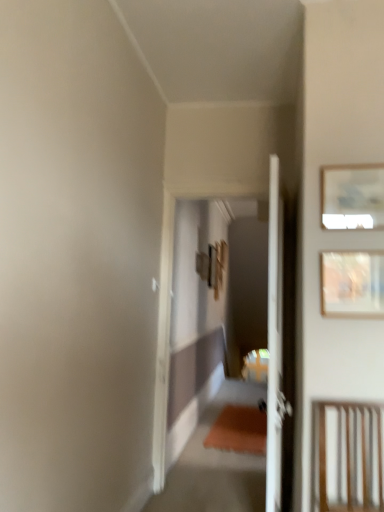
What do you see at coordinates (352, 197) in the screenshot?
I see `matte white picture frame at upper right, the second picture frame when ordered from bottom to top` at bounding box center [352, 197].

Find the location of a particular element. This screenshot has width=384, height=512. wooden slats at lower right is located at coordinates (348, 456).

Is wooden framed artwork at upper right, the 1th picture frame positioned from the bottom, shorter than matte white picture frame at upper right, the second picture frame when ordered from bottom to top?

In fact, wooden framed artwork at upper right, the 1th picture frame positioned from the bottom, may be taller than matte white picture frame at upper right, the second picture frame when ordered from bottom to top.

Can you confirm if wooden framed artwork at upper right, which ranks as the second picture frame in top-to-bottom order, is thinner than matte white picture frame at upper right, the second picture frame when ordered from bottom to top?

No.

Which of these two, wooden framed artwork at upper right, the 1th picture frame positioned from the bottom, or matte white picture frame at upper right, which is the first picture frame in top-to-bottom order, is bigger?

With larger size is wooden framed artwork at upper right, the 1th picture frame positioned from the bottom.

Is wooden framed artwork at upper right, the 1th picture frame positioned from the bottom, at the right side of matte white picture frame at upper right, which is the first picture frame in top-to-bottom order?

No.

The width and height of the screenshot is (384, 512). There is a wooden slats at lower right. In order to click on the 1st picture frame above it (from the image's perspective) in this screenshot , I will do `click(352, 284)`.

Who is taller, wooden slats at lower right or wooden framed artwork at upper right, the 1th picture frame positioned from the bottom?

With more height is wooden slats at lower right.

Considering the sizes of objects wooden slats at lower right and wooden framed artwork at upper right, which ranks as the second picture frame in top-to-bottom order, in the image provided, who is smaller, wooden slats at lower right or wooden framed artwork at upper right, which ranks as the second picture frame in top-to-bottom order,?

wooden framed artwork at upper right, which ranks as the second picture frame in top-to-bottom order.

Consider the image. Is wooden slats at lower right looking in the opposite direction of wooden framed artwork at upper right, which ranks as the second picture frame in top-to-bottom order?

That's not correct — wooden slats at lower right is not looking away from wooden framed artwork at upper right, which ranks as the second picture frame in top-to-bottom order.

Measure the distance from wooden framed artwork at upper right, which ranks as the second picture frame in top-to-bottom order, to wooden slats at lower right.

They are 52.89 centimeters apart.

Where is `furniture that is under the wooden framed artwork at upper right, which ranks as the second picture frame in top-to-bottom order (from a real-world perspective)`? Image resolution: width=384 pixels, height=512 pixels. furniture that is under the wooden framed artwork at upper right, which ranks as the second picture frame in top-to-bottom order (from a real-world perspective) is located at coordinates (348, 456).

Is there a large distance between wooden framed artwork at upper right, the 1th picture frame positioned from the bottom, and wooden slats at lower right?

No, there isn't a large distance between wooden framed artwork at upper right, the 1th picture frame positioned from the bottom, and wooden slats at lower right.

Can you confirm if wooden framed artwork at upper right, which ranks as the second picture frame in top-to-bottom order, is shorter than wooden slats at lower right?

Indeed, wooden framed artwork at upper right, which ranks as the second picture frame in top-to-bottom order, has a lesser height compared to wooden slats at lower right.

What's the angular difference between wooden slats at lower right and matte white picture frame at upper right, the second picture frame when ordered from bottom to top,'s facing directions?

The angular difference between wooden slats at lower right and matte white picture frame at upper right, the second picture frame when ordered from bottom to top, is 0.746 degrees.

Between wooden slats at lower right and matte white picture frame at upper right, which is the first picture frame in top-to-bottom order, which one has larger size?

With larger size is wooden slats at lower right.

Is point (362, 463) closer to viewer compared to point (361, 220)?

Yes.

Looking at this image, is wooden slats at lower right thinner than matte white picture frame at upper right, the second picture frame when ordered from bottom to top?

In fact, wooden slats at lower right might be wider than matte white picture frame at upper right, the second picture frame when ordered from bottom to top.

Is the position of matte white picture frame at upper right, which is the first picture frame in top-to-bottom order, more distant than that of wooden framed artwork at upper right, the 1th picture frame positioned from the bottom?

Yes, matte white picture frame at upper right, which is the first picture frame in top-to-bottom order, is further from the camera.

From a real-world perspective, between matte white picture frame at upper right, which is the first picture frame in top-to-bottom order, and wooden framed artwork at upper right, the 1th picture frame positioned from the bottom, who is vertically lower?

From a 3D spatial view, wooden framed artwork at upper right, the 1th picture frame positioned from the bottom, is below.

Is matte white picture frame at upper right, the second picture frame when ordered from bottom to top, situated inside wooden slats at lower right or outside?

matte white picture frame at upper right, the second picture frame when ordered from bottom to top, is not enclosed by wooden slats at lower right.

At what (x,y) coordinates should I click in order to perform the action: click on furniture below the matte white picture frame at upper right, which is the first picture frame in top-to-bottom order (from the image's perspective). Please return your answer as a coordinate pair (x, y). Looking at the image, I should click on (348, 456).

In the image, is matte white picture frame at upper right, which is the first picture frame in top-to-bottom order, positioned in front of or behind wooden slats at lower right?

matte white picture frame at upper right, which is the first picture frame in top-to-bottom order, is positioned farther from the viewer than wooden slats at lower right.

Who is smaller, matte white picture frame at upper right, the second picture frame when ordered from bottom to top, or wooden slats at lower right?

matte white picture frame at upper right, the second picture frame when ordered from bottom to top.

Find the location of a particular element. picture frame that appears below the matte white picture frame at upper right, which is the first picture frame in top-to-bottom order (from the image's perspective) is located at coordinates 352,284.

Which picture frame is the 1st one when counting from the right side of the wooden slats at lower right? Please provide its 2D coordinates.

[(352, 284)]

Considering their positions, is wooden framed artwork at upper right, the 1th picture frame positioned from the bottom, positioned closer to wooden slats at lower right than matte white picture frame at upper right, the second picture frame when ordered from bottom to top?

wooden framed artwork at upper right, the 1th picture frame positioned from the bottom, lies closer to wooden slats at lower right than the other object.

When comparing their distances from matte white picture frame at upper right, which is the first picture frame in top-to-bottom order, does wooden framed artwork at upper right, the 1th picture frame positioned from the bottom, or wooden slats at lower right seem closer?

wooden framed artwork at upper right, the 1th picture frame positioned from the bottom, lies closer to matte white picture frame at upper right, which is the first picture frame in top-to-bottom order, than the other object.

Which object lies nearer to the anchor point wooden slats at lower right, matte white picture frame at upper right, which is the first picture frame in top-to-bottom order, or wooden framed artwork at upper right, which ranks as the second picture frame in top-to-bottom order?

wooden framed artwork at upper right, which ranks as the second picture frame in top-to-bottom order.

Estimate the real-world distances between objects in this image. Which object is closer to matte white picture frame at upper right, which is the first picture frame in top-to-bottom order, wooden slats at lower right or wooden framed artwork at upper right, the 1th picture frame positioned from the bottom?

wooden framed artwork at upper right, the 1th picture frame positioned from the bottom.

When comparing their distances from wooden framed artwork at upper right, the 1th picture frame positioned from the bottom, does wooden slats at lower right or matte white picture frame at upper right, the second picture frame when ordered from bottom to top, seem closer?

Among the two, matte white picture frame at upper right, the second picture frame when ordered from bottom to top, is located nearer to wooden framed artwork at upper right, the 1th picture frame positioned from the bottom.

Based on their spatial positions, is matte white picture frame at upper right, the second picture frame when ordered from bottom to top, or wooden slats at lower right closer to wooden framed artwork at upper right, the 1th picture frame positioned from the bottom?

The object closer to wooden framed artwork at upper right, the 1th picture frame positioned from the bottom, is matte white picture frame at upper right, the second picture frame when ordered from bottom to top.

Find the location of a particular element. picture frame between matte white picture frame at upper right, which is the first picture frame in top-to-bottom order, and wooden slats at lower right vertically is located at coordinates (352, 284).